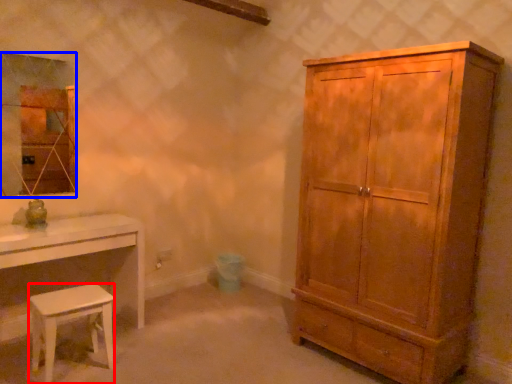
Question: Which of the following is the closest to the observer, stool (highlighted by a red box) or mirror (highlighted by a blue box)?

Choices:
 (A) stool
 (B) mirror

Answer: (A)